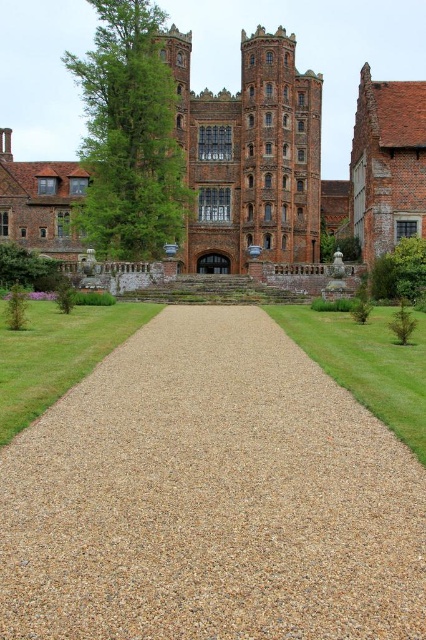
Question: Which point is farther to the camera?

Choices:
 (A) green grass at center
 (B) brown brick castle at center

Answer: (B)

Question: Among these objects, which one is farthest from the camera?

Choices:
 (A) green grass at lower left
 (B) green grass at center
 (C) brown brick castle at center
 (D) brown gravel at center

Answer: (C)

Question: From the image, what is the correct spatial relationship of brown gravel at center in relation to green grass at lower left?

Choices:
 (A) below
 (B) above

Answer: (A)

Question: Observing the image, what is the correct spatial positioning of brown brick castle at center in reference to green grass at lower left?

Choices:
 (A) left
 (B) right

Answer: (B)

Question: Which point is closer to the camera taking this photo?

Choices:
 (A) (377, 163)
 (B) (0, 314)
 (C) (108, 611)
 (D) (382, 365)

Answer: (C)

Question: Can you confirm if brown brick castle at center is positioned below green grass at lower left?

Choices:
 (A) yes
 (B) no

Answer: (B)